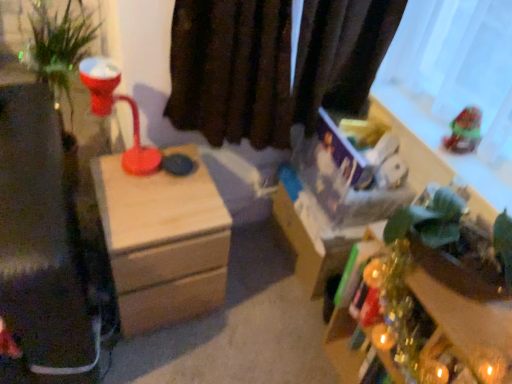
Identify the location of green matte plant at lower right. This screenshot has width=512, height=384. (426, 318).

What is the approximate height of shiny plastic toy at upper right?

It is 5.57 inches.

This screenshot has height=384, width=512. Identify the location of green matte plant at lower right. (426, 318).

Considering the relative sizes of wooden nightstand at center and green matte plant at lower right in the image provided, is wooden nightstand at center wider than green matte plant at lower right?

Indeed, wooden nightstand at center has a greater width compared to green matte plant at lower right.

Locate an element on the screen. table below the wooden nightstand at center (from the image's perspective) is located at coordinates (426, 318).

Does wooden nightstand at center lie behind green matte plant at lower right?

Yes, the depth of wooden nightstand at center is greater than that of green matte plant at lower right.

From their relative heights in the image, would you say wooden nightstand at center is taller or shorter than green matte plant at lower right?

Considering their sizes, wooden nightstand at center has more height than green matte plant at lower right.

Is shiny plastic toy at upper right shorter than green matte plant at lower right?

Yes.

From the image's perspective, which one is positioned higher, shiny plastic toy at upper right or green matte plant at lower right?

shiny plastic toy at upper right, from the image's perspective.

Is shiny plastic toy at upper right aimed at green matte plant at lower right?

No, shiny plastic toy at upper right does not turn towards green matte plant at lower right.

Which object is more forward, shiny plastic toy at upper right or green matte plant at lower right?

green matte plant at lower right is more forward.

From the image's perspective, which is below, shiny plastic toy at upper right or wooden nightstand at center?

wooden nightstand at center.

Considering the relative positions of shiny plastic toy at upper right and wooden nightstand at center in the image provided, is shiny plastic toy at upper right to the right of wooden nightstand at center from the viewer's perspective?

Indeed, shiny plastic toy at upper right is positioned on the right side of wooden nightstand at center.

Could you tell me if shiny plastic toy at upper right is facing wooden nightstand at center?

No, shiny plastic toy at upper right is not aimed at wooden nightstand at center.

From a real-world perspective, who is located lower, shiny plastic toy at upper right or wooden nightstand at center?

In real-world perspective, wooden nightstand at center is lower.

Does point (222, 269) appear closer or farther from the camera than point (450, 124)?

Clearly, point (222, 269) is more distant from the camera than point (450, 124).

Is wooden nightstand at center taller than shiny plastic toy at upper right?

Correct, wooden nightstand at center is much taller as shiny plastic toy at upper right.

From the image's perspective, is wooden nightstand at center above shiny plastic toy at upper right?

No, from the image's perspective, wooden nightstand at center is not above shiny plastic toy at upper right.

Who is smaller, wooden nightstand at center or shiny plastic toy at upper right?

shiny plastic toy at upper right.

Is shiny plastic toy at upper right at the back of green matte plant at lower right?

No, shiny plastic toy at upper right is not at the back of green matte plant at lower right.

From the image's perspective, is green matte plant at lower right on shiny plastic toy at upper right?

No, from the image's perspective, green matte plant at lower right is not on top of shiny plastic toy at upper right.

Is green matte plant at lower right beside shiny plastic toy at upper right?

No.

Does green matte plant at lower right turn towards wooden nightstand at center?

No, green matte plant at lower right is not turned towards wooden nightstand at center.

Which object is closer to the camera taking this photo, green matte plant at lower right or wooden nightstand at center?

green matte plant at lower right is in front.

Based on the photo, from a real-world perspective, is green matte plant at lower right positioned above or below wooden nightstand at center?

green matte plant at lower right is above wooden nightstand at center.

You are a GUI agent. You are given a task and a screenshot of the screen. Output one action in this format:
    pyautogui.click(x=<x>, y=<y>)
    Task: Click on the table below the wooden nightstand at center (from the image's perspective)
    The height and width of the screenshot is (384, 512).
    Given the screenshot: What is the action you would take?
    pyautogui.click(x=426, y=318)

Identify the location of table in front of the shiny plastic toy at upper right. The width and height of the screenshot is (512, 384). (426, 318).

Which object lies nearer to the anchor point wooden nightstand at center, shiny plastic toy at upper right or green matte plant at lower right?

green matte plant at lower right lies closer to wooden nightstand at center than the other object.

Based on their spatial positions, is green matte plant at lower right or wooden nightstand at center closer to shiny plastic toy at upper right?

green matte plant at lower right lies closer to shiny plastic toy at upper right than the other object.

Considering their positions, is shiny plastic toy at upper right positioned closer to green matte plant at lower right than wooden nightstand at center?

Based on the image, shiny plastic toy at upper right appears to be nearer to green matte plant at lower right.

Considering their positions, is wooden nightstand at center positioned further to shiny plastic toy at upper right than green matte plant at lower right?

wooden nightstand at center.

Looking at the image, which one is located closer to green matte plant at lower right, wooden nightstand at center or shiny plastic toy at upper right?

Among the two, shiny plastic toy at upper right is located nearer to green matte plant at lower right.

Based on their spatial positions, is green matte plant at lower right or shiny plastic toy at upper right further from wooden nightstand at center?

Among the two, shiny plastic toy at upper right is located further to wooden nightstand at center.

Locate an element on the screen. The height and width of the screenshot is (384, 512). table between wooden nightstand at center and shiny plastic toy at upper right from left to right is located at coordinates (426, 318).